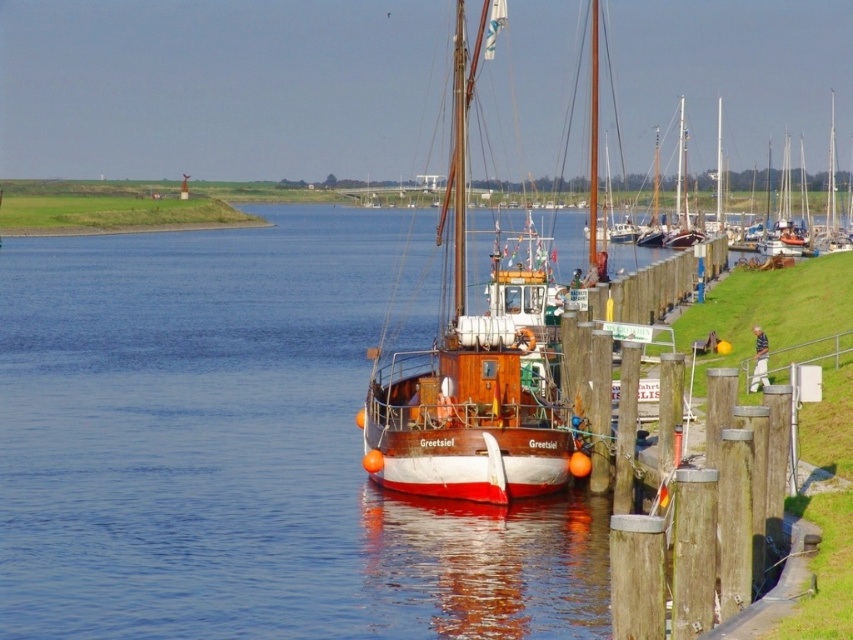
Is smooth blue water at center thinner than wooden sailboat at center?

No, smooth blue water at center is not thinner than wooden sailboat at center.

Does smooth blue water at center have a lesser height compared to wooden sailboat at center?

Yes, smooth blue water at center is shorter than wooden sailboat at center.

Locate an element on the screen. smooth blue water at center is located at coordinates (247, 448).